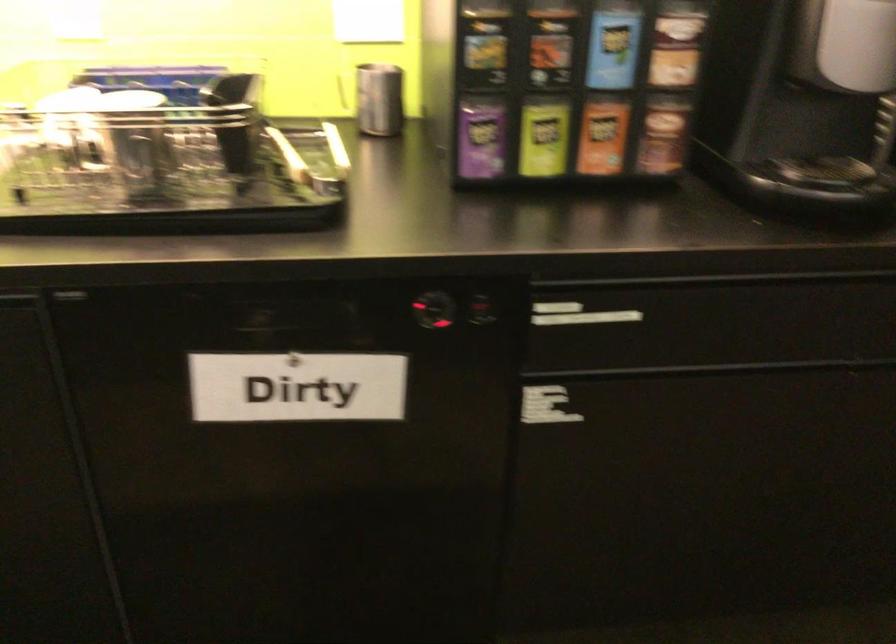
You are a GUI agent. You are given a task and a screenshot of the screen. Output one action in this format:
    pyautogui.click(x=<x>, y=<y>)
    Task: Click on the blue tea box
    This screenshot has height=644, width=896.
    Given the screenshot: What is the action you would take?
    pyautogui.click(x=613, y=44)